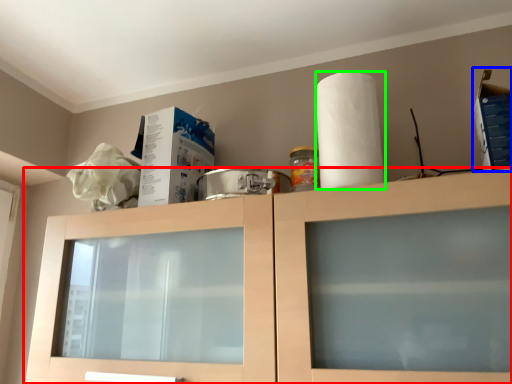
Question: Based on their relative distances, which object is farther from cabinetry (highlighted by a red box)? Choose from box (highlighted by a blue box) and paper towel (highlighted by a green box).

Choices:
 (A) box
 (B) paper towel

Answer: (A)